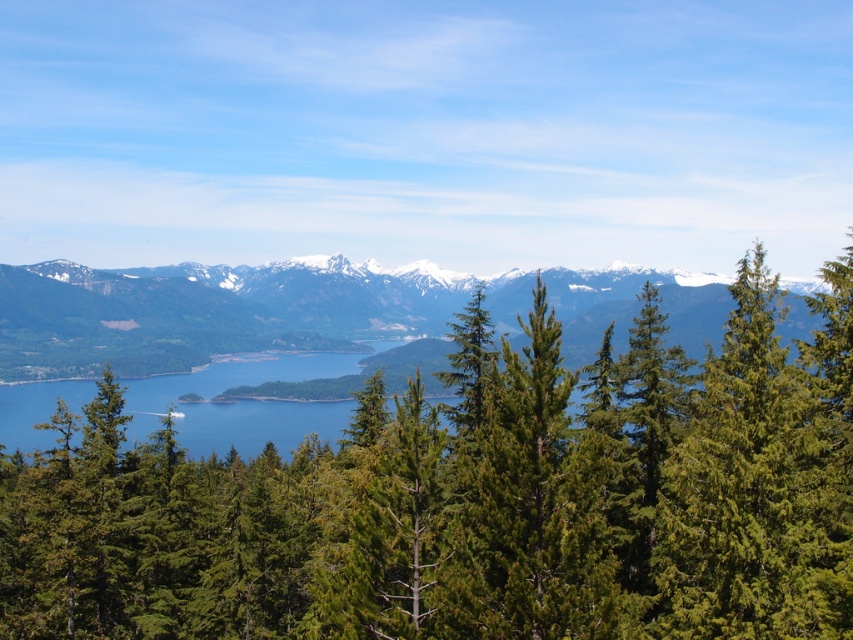
You are standing at the edge of the lake in the image and want to determine the relative positions of two points marked in the scene. Which of the two points, point (619, 433) or point (329, 260), is closer to you?

Point (619, 433) is closer to the viewer than point (329, 260).